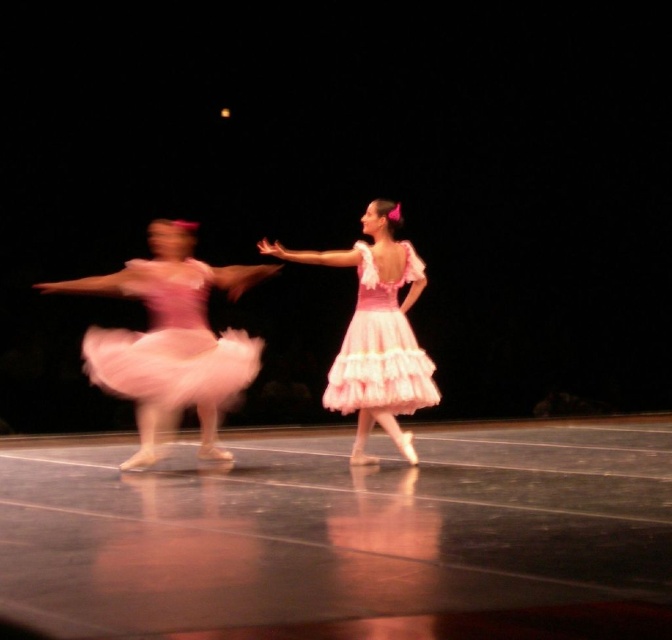
Is matte pink tutu at left to the left of matte pink tulle dress at left from the viewer's perspective?

Indeed, matte pink tutu at left is positioned on the left side of matte pink tulle dress at left.

Does matte pink tutu at left have a larger size compared to matte pink tulle dress at left?

Yes, matte pink tutu at left is bigger than matte pink tulle dress at left.

Is point (138, 413) closer to viewer compared to point (132, 268)?

No, (138, 413) is behind (132, 268).

The image size is (672, 640). What are the coordinates of `matte pink tutu at left` in the screenshot? It's located at (169, 339).

Does matte pink tutu at left have a lesser height compared to matte pink tutu at center?

Indeed, matte pink tutu at left has a lesser height compared to matte pink tutu at center.

Can you confirm if matte pink tutu at left is bigger than matte pink tutu at center?

Correct, matte pink tutu at left is larger in size than matte pink tutu at center.

Which is behind, point (138, 388) or point (368, 269)?

The point (368, 269) is behind.

I want to click on matte pink tutu at left, so click(169, 339).

Can you confirm if matte pink tutu at center is positioned above matte pink tulle dress at center?

Incorrect, matte pink tutu at center is not positioned above matte pink tulle dress at center.

This screenshot has width=672, height=640. What do you see at coordinates (376, 332) in the screenshot?
I see `matte pink tutu at center` at bounding box center [376, 332].

Where is `matte pink tutu at center`? The image size is (672, 640). matte pink tutu at center is located at coordinates (376, 332).